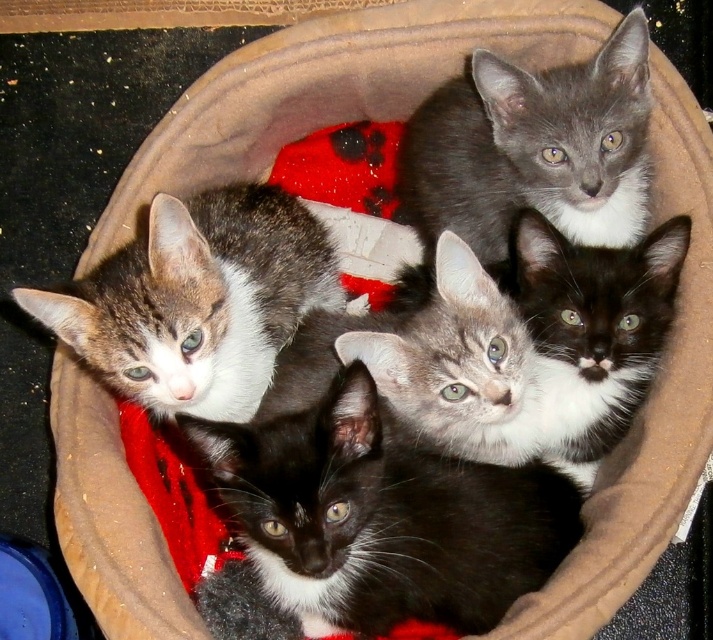
You are holding a toy mouse and want to toss it to the speckled fur kitten at upper left. If the toy can travel 4 feet, will it reach the kitten?

The distance of the speckled fur kitten at upper left from the viewer is 4.21 feet, so the toy mouse can only travel 4 feet. Therefore, the toy will not reach the kitten.

You are a photographer trying to capture a closeup shot of the kitten at point (302, 486) without disturbing the others. Since you need to focus on that specific kitten, will the kitten at point (635, 225) block your view?

Point (302, 486) is in front of point (635, 225), so the kitten at point (635, 225) will not block your view of the kitten at point (302, 486).